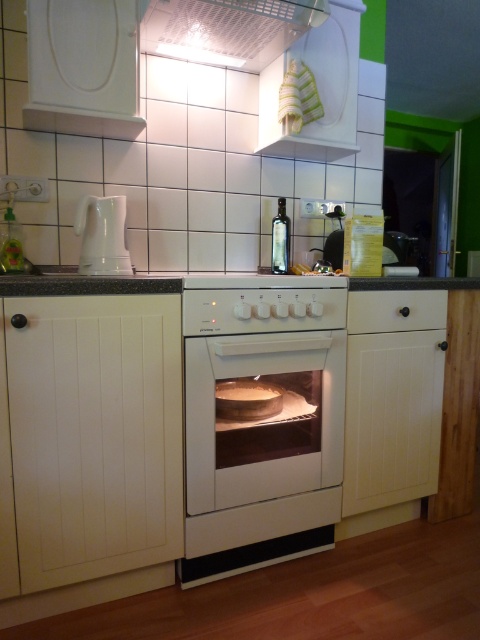
Who is taller, granite/black at center or white glossy kettle at left?

With more height is white glossy kettle at left.

Is granite/black at center below white glossy kettle at left?

Correct, granite/black at center is located below white glossy kettle at left.

Is point (153, 276) farther from viewer compared to point (81, 205)?

No, (153, 276) is in front of (81, 205).

This screenshot has width=480, height=640. I want to click on granite/black at center, so click(x=84, y=284).

Which of these two, white matte oven at center or white wood drawer at right, stands shorter?

Standing shorter between the two is white wood drawer at right.

Can you confirm if white matte oven at center is positioned to the right of white wood drawer at right?

In fact, white matte oven at center is to the left of white wood drawer at right.

I want to click on white matte oven at center, so click(x=261, y=419).

Identify the location of white matte oven at center. (261, 419).

Between point (266, 509) and point (360, 280), which one is positioned in front?

Positioned in front is point (266, 509).

Does white matte oven at center have a greater width compared to granite/black at center?

In fact, white matte oven at center might be narrower than granite/black at center.

Who is more distant from viewer, (316, 480) or (142, 284)?

Point (316, 480)

Identify the location of white matte oven at center. (261, 419).